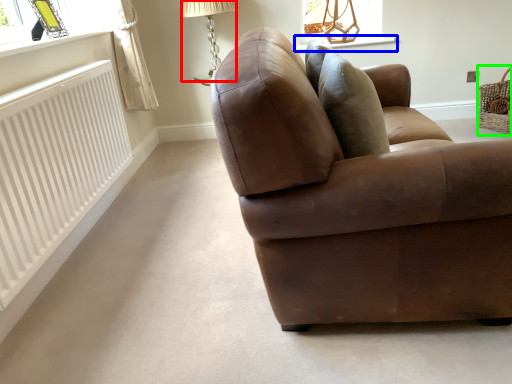
Question: Considering the real-world distances, which object is closest to table lamp (highlighted by a red box)? window sill (highlighted by a blue box) or basket (highlighted by a green box).

Choices:
 (A) window sill
 (B) basket

Answer: (A)